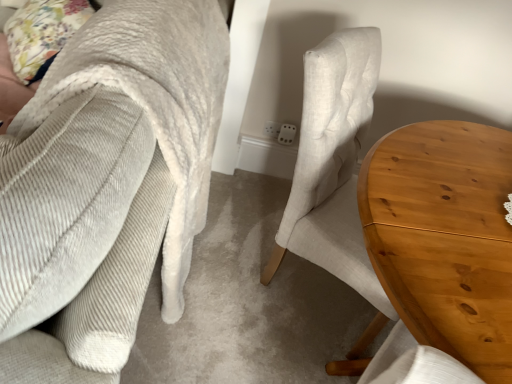
Question: Which is correct: floral fabric pillow at upper left is inside light brown wood table at center right, or outside of it?

Choices:
 (A) outside
 (B) inside

Answer: (A)

Question: Is point (53, 46) closer or farther from the camera than point (417, 261)?

Choices:
 (A) farther
 (B) closer

Answer: (A)

Question: Which object is the closest to the floral fabric pillow at upper left?

Choices:
 (A) light brown wood table at center right
 (B) corduroy fabric chair at center

Answer: (B)

Question: Considering the real-world distances, which object is farthest from the corduroy fabric chair at center?

Choices:
 (A) floral fabric pillow at upper left
 (B) light brown wood table at center right

Answer: (A)